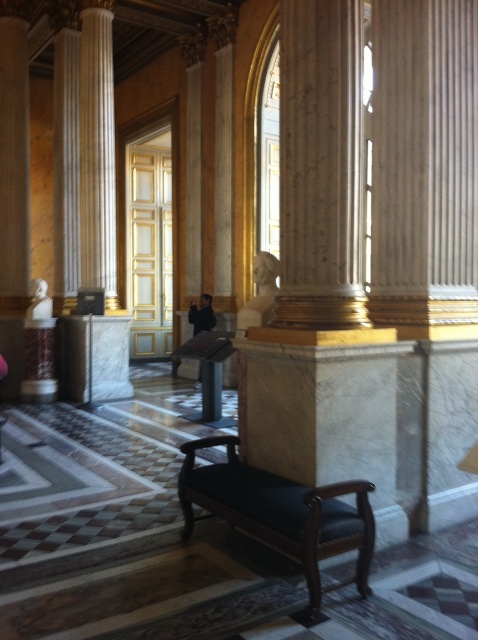
Can you confirm if dark wood bench at center is positioned below marble column at left?

Yes, dark wood bench at center is below marble column at left.

Can you confirm if dark wood bench at center is wider than marble column at left?

Yes, dark wood bench at center is wider than marble column at left.

What do you see at coordinates (281, 513) in the screenshot?
I see `dark wood bench at center` at bounding box center [281, 513].

This screenshot has width=478, height=640. Identify the location of dark wood bench at center. (281, 513).

Can you confirm if dark wood bench at center is thinner than white marble bust at left?

Incorrect, dark wood bench at center's width is not less than white marble bust at left's.

Between dark wood bench at center and white marble bust at left, which one appears on the left side from the viewer's perspective?

white marble bust at left

Identify the location of dark wood bench at center. The image size is (478, 640). (281, 513).

Does marble column at left appear on the right side of white marble bust at left?

Correct, you'll find marble column at left to the right of white marble bust at left.

Measure the distance between point (96, 150) and camera.

They are 31.13 feet apart.

Find the location of `marble column at left`. marble column at left is located at coordinates (97, 152).